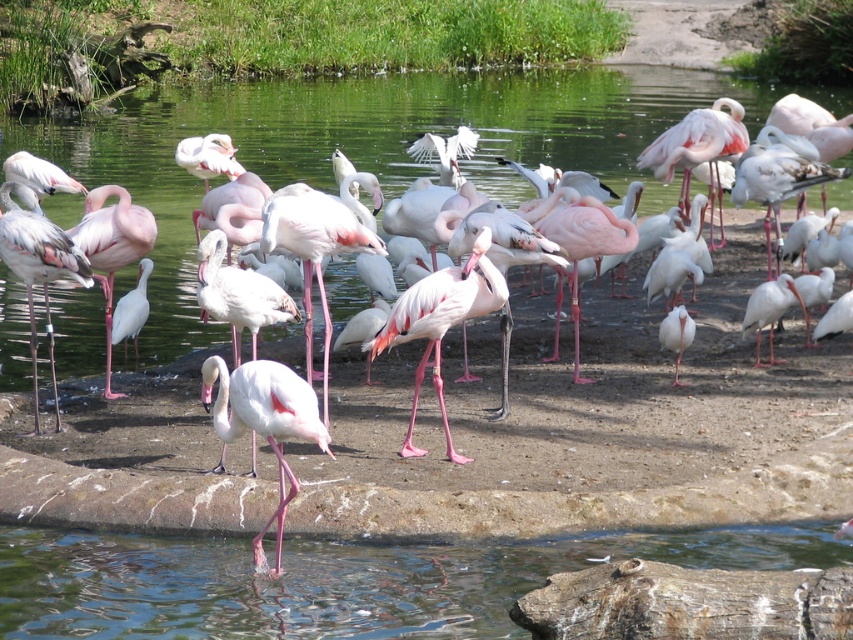
Which of these two, pink matte flamingo at center or white matte bird at center-right, stands shorter?

white matte bird at center-right is shorter.

Is pink matte flamingo at center shorter than white matte bird at center-right?

In fact, pink matte flamingo at center may be taller than white matte bird at center-right.

Identify the location of pink matte flamingo at center. [x=440, y=321].

Does brown textured log at lower center have a larger size compared to matte pink flamingo at center?

Incorrect, brown textured log at lower center is not larger than matte pink flamingo at center.

This screenshot has height=640, width=853. In order to click on brown textured log at lower center in this screenshot , I will do `click(688, 604)`.

Can you confirm if clear water at lower center is positioned to the right of pink matte flamingo at upper center?

Indeed, clear water at lower center is positioned on the right side of pink matte flamingo at upper center.

This screenshot has width=853, height=640. I want to click on clear water at lower center, so click(x=335, y=580).

Describe the element at coordinates (335, 580) in the screenshot. I see `clear water at lower center` at that location.

Locate an element on the screen. clear water at lower center is located at coordinates (335, 580).